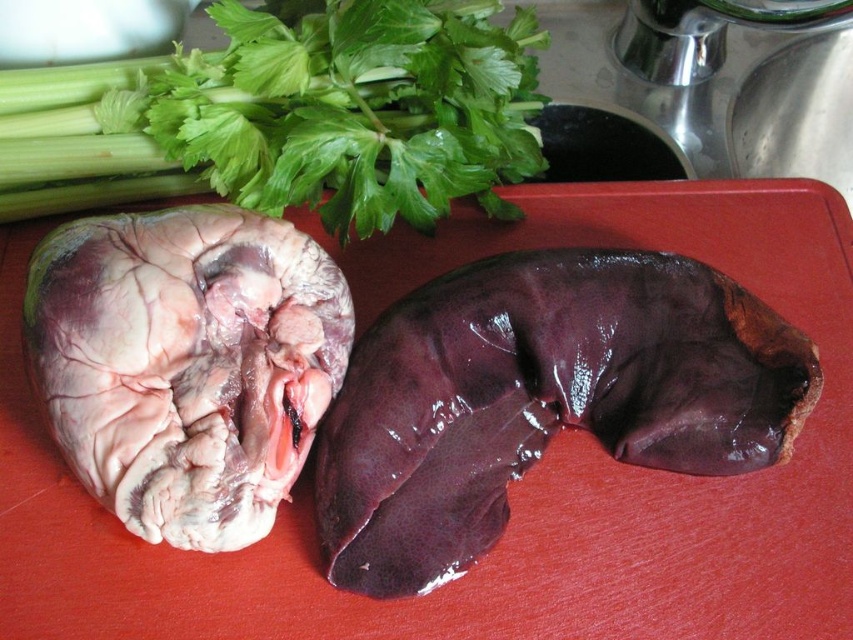
Who is positioned more to the left, dark purple glossy liver at center or green leafy vegetable at upper left?

Positioned to the left is green leafy vegetable at upper left.

Which is below, dark purple glossy liver at center or green leafy vegetable at upper left?

Positioned lower is dark purple glossy liver at center.

Is point (548, 339) positioned in front of point (247, 118)?

Yes, it is.

Locate an element on the screen. Image resolution: width=853 pixels, height=640 pixels. dark purple glossy liver at center is located at coordinates (543, 397).

Is point (236, 90) positioned behind point (233, 260)?

Yes, point (236, 90) is farther from viewer.

Which is behind, point (28, 208) or point (173, 472)?

Positioned behind is point (28, 208).

The width and height of the screenshot is (853, 640). Identify the location of green leafy vegetable at upper left. (289, 115).

Does dark purple glossy liver at center have a smaller size compared to pinkish white flesh at center?

No.

Which is behind, point (456, 394) or point (187, 365)?

The point (456, 394) is behind.

Does point (714, 323) lie behind point (299, 444)?

Yes, it is.

Locate an element on the screen. dark purple glossy liver at center is located at coordinates (543, 397).